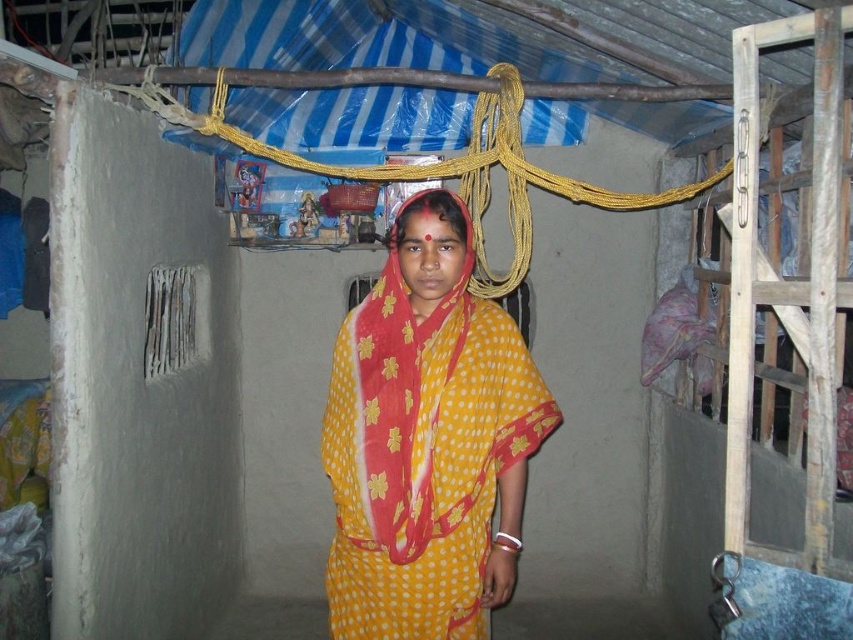
You are an interior designer assessing the space. The yellow dotted fabric at center is part of the woman standing in the scene. Based on its position at coordinates point 0.691, 0.502, can you determine if it is positioned closer to the left or right side of the room?

The yellow dotted fabric at center is located at point (427,442), which indicates it is closer to the right side of the room since the x coordinate is 0.691, which is more than 0.5.

You are a tailor observing the yellow dotted fabric at center and the yellow dotted saree at center. Which item is placed below the other?

The yellow dotted fabric at center is positioned under the yellow dotted saree at center.